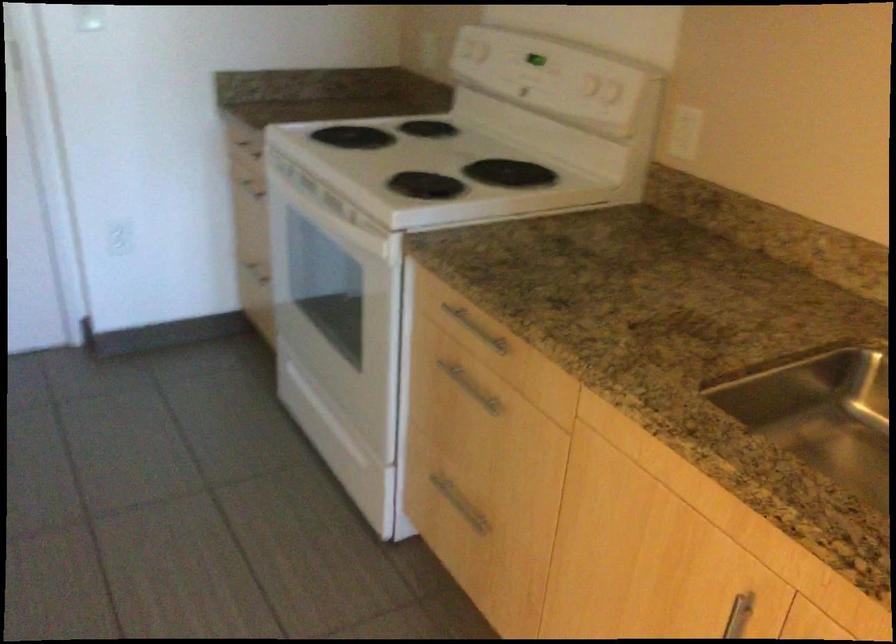
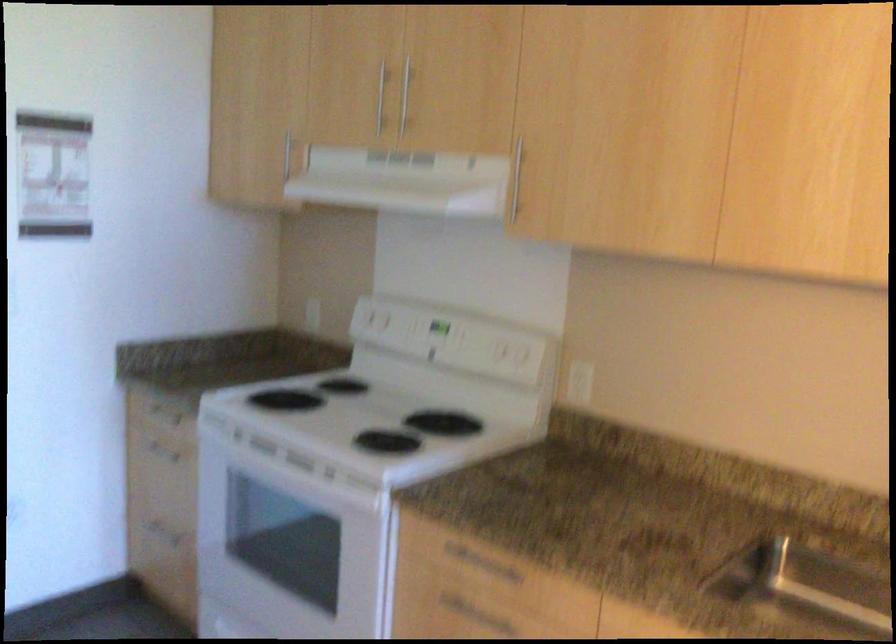
Locate, in the second image, the point that corresponds to the point at 427,161 in the first image.

(367, 415)